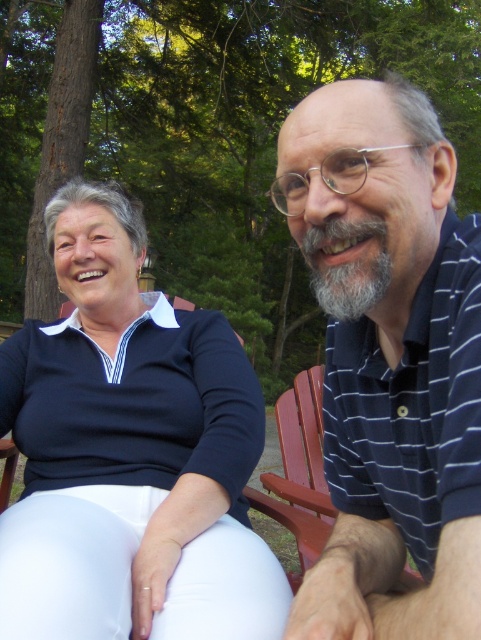
You are a photographer standing in front of the two people in the image. You want to take a closeup photo of the striped polo shirt at right. Can you estimate how far you need to move forward or backward to get the best shot?

The striped polo shirt at right is 22.71 inches away from the viewer. To get a closeup, you would need to move closer by approximately 22.71 inches to capture the shirt in focus.

You are planning to take a photo of the two people in the scene. The camera you are using has a limited focus range that can only accommodate objects up to 1.5 meters in size. Given that the matte black shirt at left is bigger than the red wood chair at right, will both subjects fit within the camera focus range?

The matte black shirt at left is bigger than the red wood chair at right. Since the camera can focus on objects up to 1.5 meters, both subjects will fit within the focus range as long as their sizes individually do not exceed this limit. However, the exact sizes are not provided, so this depends on their actual dimensions.

You are a photographer trying to capture a photo of the striped polo shirt at right. The camera you are using has a limited field of view and can only focus on objects within a small area. You notice a point at coordinates point (x=389, y=360). Is this point likely to be part of the striped polo shirt at right?

Yes, the point (x=389, y=360) is where the striped polo shirt at right is located, so it is part of the striped polo shirt at right.